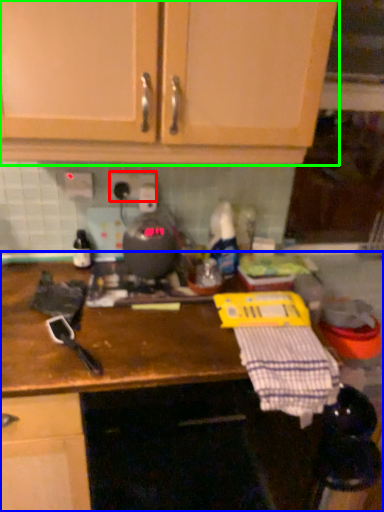
Question: Which object is the closest to the electric outlet (highlighted by a red box)? Choose among these: countertop (highlighted by a blue box) or cabinetry (highlighted by a green box).

Choices:
 (A) countertop
 (B) cabinetry

Answer: (B)